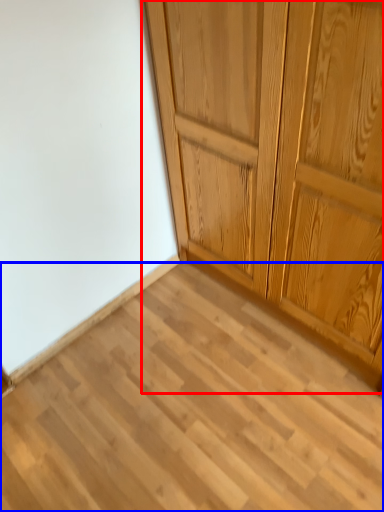
Question: Which object appears closest to the camera in this image, cupboard (highlighted by a red box) or plank (highlighted by a blue box)?

Choices:
 (A) cupboard
 (B) plank

Answer: (A)